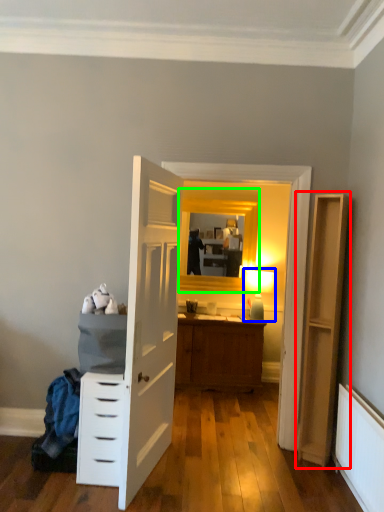
Question: Considering the real-world distances, which object is closest to file cabinet (highlighted by a red box)? light fixture (highlighted by a blue box) or window (highlighted by a green box).

Choices:
 (A) light fixture
 (B) window

Answer: (A)